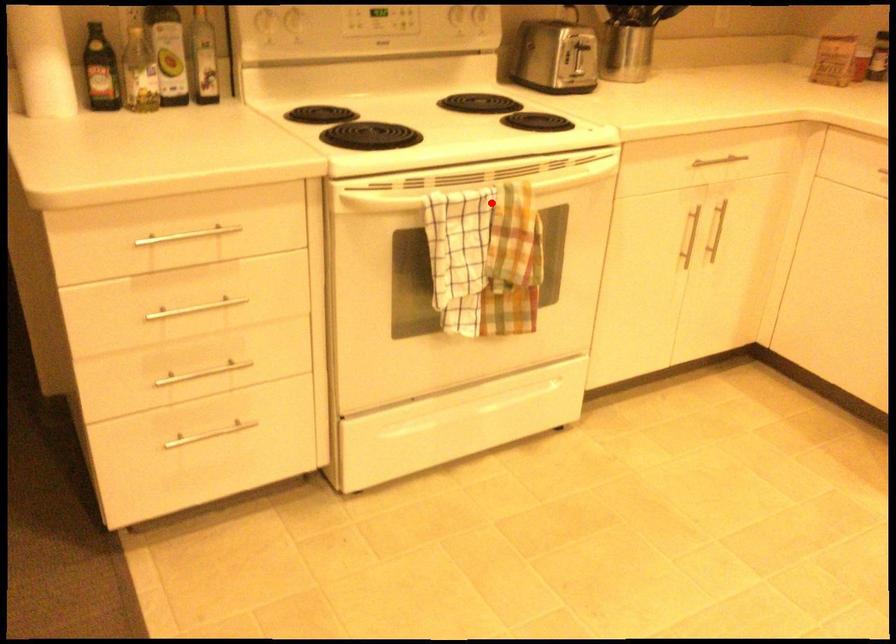
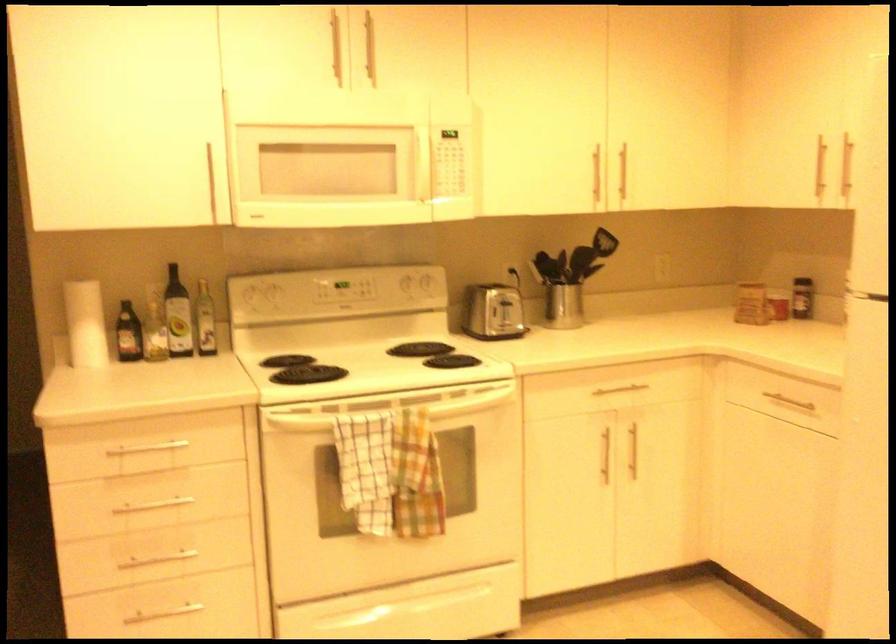
Find the pixel in the second image that matches the highlighted location in the first image.

(390, 424)